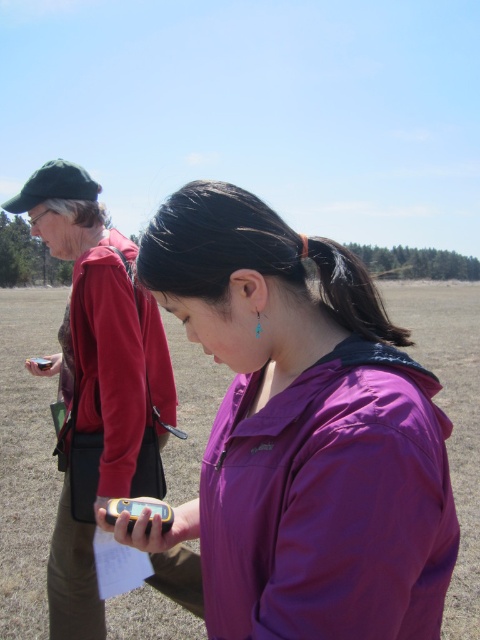
You are standing at point (322, 241) and want to walk to the person in the purple jacket. Which direction should you move relative to point (295, 413)?

You should move towards point (295, 413) because it is in front of point (322, 241), so moving towards it will lead you closer to the person in the purple jacket.

You are a hiker trying to locate your friend in the grassy field. You see the purple fabric jacket at center and the matte red jacket at center. Which jacket is lower in the image?

The purple fabric jacket at center is below the matte red jacket at center, so the purple fabric jacket at center is lower in the image.